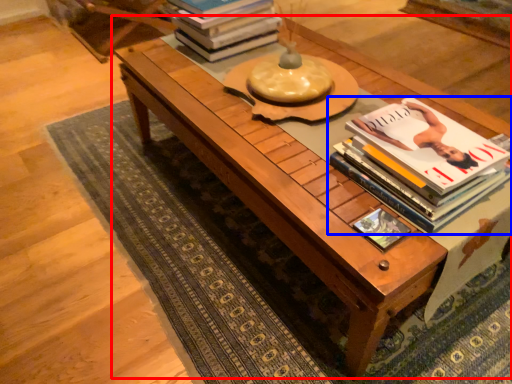
Question: Which of the following is the closest to the observer, table (highlighted by a red box) or book (highlighted by a blue box)?

Choices:
 (A) table
 (B) book

Answer: (A)